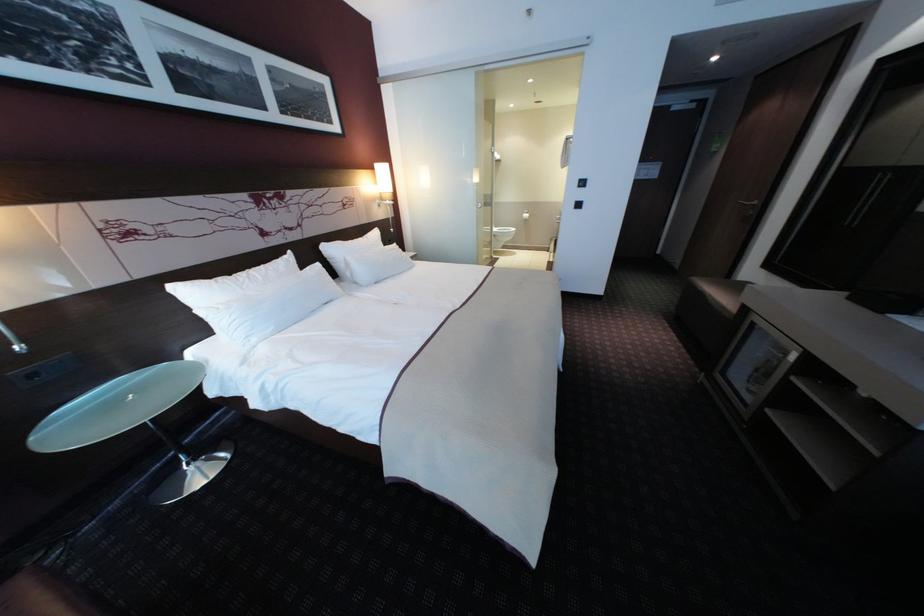
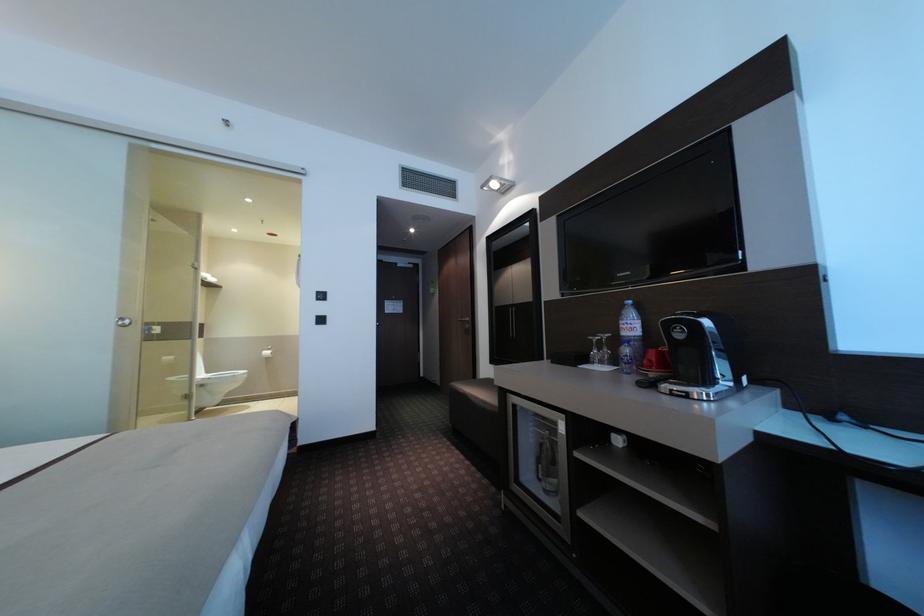
First-person continuous shooting, in which direction is the camera rotating?

The camera's rotation is toward right-up.